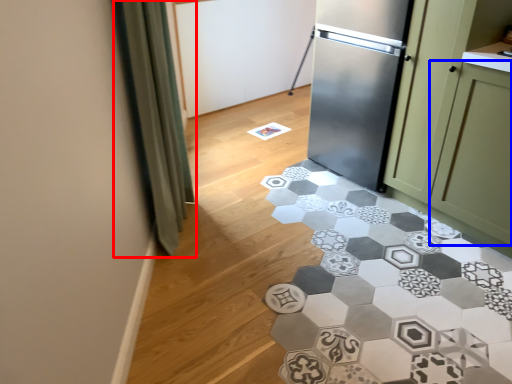
Question: Which object is further to the camera taking this photo, curtain (highlighted by a red box) or glass door (highlighted by a blue box)?

Choices:
 (A) curtain
 (B) glass door

Answer: (B)